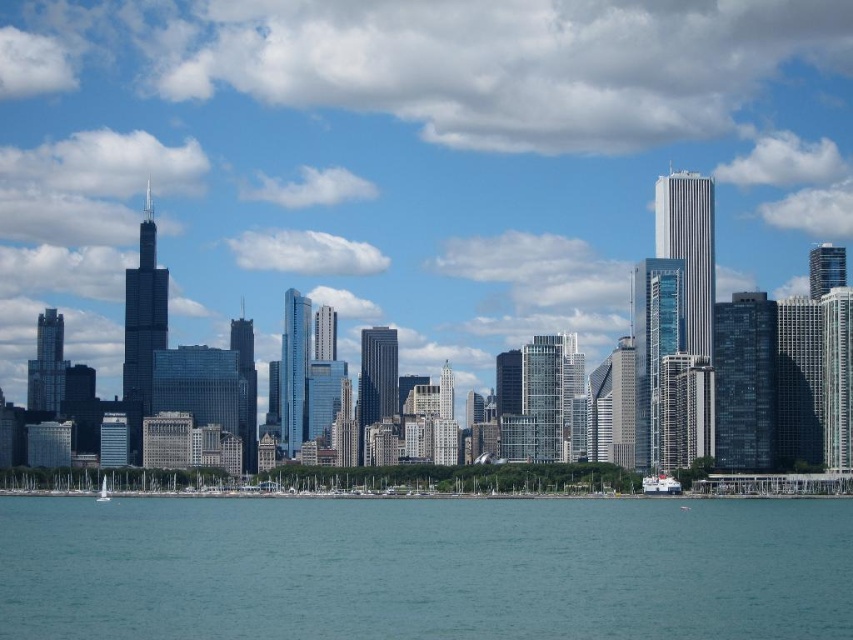
You are a photographer planning to capture the city skyline reflected in the blue water at lower center. However, you notice the white matte boat at lower right might obstruct the reflection. Based on their sizes, can the boat fit entirely within the water area without covering the entire reflection?

The blue water at lower center has a larger size compared to white matte boat at lower right, so yes, the boat can fit entirely within the water area without covering the entire reflection.

You are a photographer planning to capture the city skyline from the water. You have two boats available for this shoot. The white matte boat at lower right and the white glossy sailboat at lower left. Which boat should you choose if you want to ensure that the boat does not block the view of the Willis Tower on the left side of the skyline?

The white glossy sailboat at lower left is taller than the white matte boat at lower right. Since the Willis Tower is on the left side of the skyline, choosing the shorter white matte boat at lower right would minimize the chance of blocking the view of the Willis Tower.

You are a tourist standing on the dock and want to take a photo of both the white matte boat at lower right and the white glossy sailboat at lower left. Which boat should you position closer to the center of the frame to include both in your shot?

You should position the white glossy sailboat at lower left closer to the center of the frame because it is located to the left of the white matte boat at lower right, allowing both boats to be included in the photo.